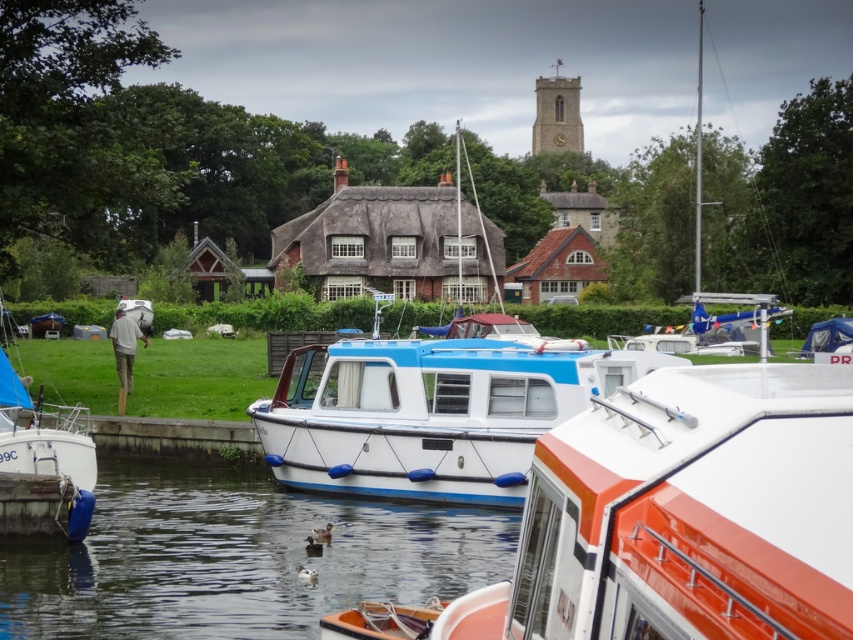
Question: Is white plastic boat at center to the right of blue matte boat at center from the viewer's perspective?

Choices:
 (A) no
 (B) yes

Answer: (A)

Question: Among these objects, which one is farthest from the camera?

Choices:
 (A) blue matte boat at center
 (B) white plastic boat at center

Answer: (A)

Question: Does white plastic boat at center have a smaller size compared to blue matte boat at center?

Choices:
 (A) yes
 (B) no

Answer: (A)

Question: Is white plastic boat at center below blue matte boat at center?

Choices:
 (A) no
 (B) yes

Answer: (B)

Question: Which object is farther from the camera taking this photo?

Choices:
 (A) blue matte boat at center
 (B) white plastic boat at center

Answer: (A)